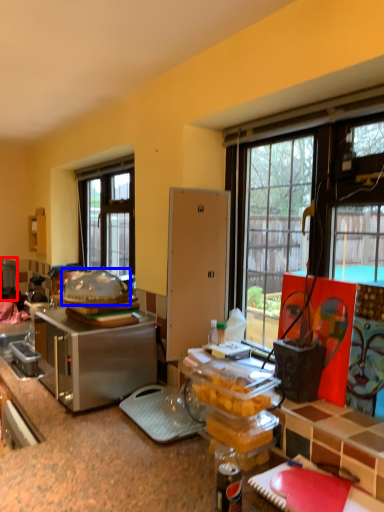
Question: Which point is closer to the camera, appliance (highlighted by a red box) or food (highlighted by a blue box)?

Choices:
 (A) appliance
 (B) food

Answer: (B)